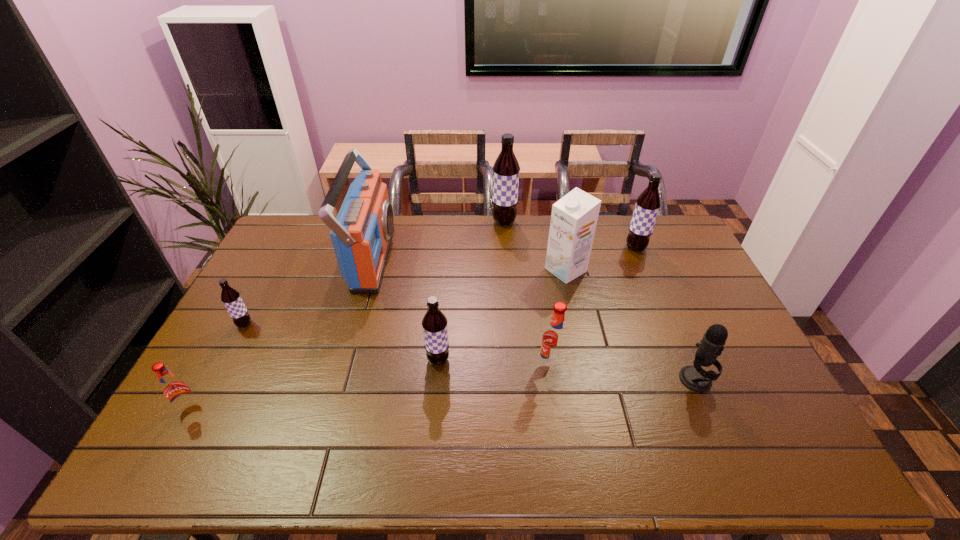
Find the location of a particular element. object that is the seventh closest to the leftmost brown root beer is located at coordinates (695, 378).

In order to click on root beer that stands as the fourth closest to the carton in this screenshot , I will do 434,323.

Image resolution: width=960 pixels, height=540 pixels. Find the location of `the closest root beer relative to the bigger red root beer`. the closest root beer relative to the bigger red root beer is located at coordinates (434, 323).

Where is `the closest brown root beer to the tallest root beer`? the closest brown root beer to the tallest root beer is located at coordinates (648, 203).

Identify which brown root beer is located as the second nearest to the black microphone. Please provide its 2D coordinates. Your answer should be formatted as a tuple, i.e. [(x, y)], where the tuple contains the x and y coordinates of a point satisfying the conditions above.

[(434, 323)]

Where is `vacant space that satisfies the following two spatial constraints: 1. on the front side of the farthest root beer; 2. on the left side of the second biggest brown root beer`? The image size is (960, 540). vacant space that satisfies the following two spatial constraints: 1. on the front side of the farthest root beer; 2. on the left side of the second biggest brown root beer is located at coordinates (506, 248).

The height and width of the screenshot is (540, 960). I want to click on free space that satisfies the following two spatial constraints: 1. on the front-facing side of the right red root beer; 2. on the right side of the third object from left to right, so click(x=342, y=366).

Image resolution: width=960 pixels, height=540 pixels. Identify the location of free space that satisfies the following two spatial constraints: 1. on the front side of the rightmost brown root beer; 2. on the right side of the farthest brown root beer. (506, 248).

Image resolution: width=960 pixels, height=540 pixels. I want to click on vacant region that satisfies the following two spatial constraints: 1. on the front-facing side of the third object from left to right; 2. on the back side of the third root beer from left to right, so click(343, 360).

At what (x,y) coordinates should I click in order to perform the action: click on vacant space that satisfies the following two spatial constraints: 1. on the back side of the farthest brown root beer; 2. on the left side of the nearest brown root beer. Please return your answer as a coordinate pair (x, y). The height and width of the screenshot is (540, 960). Looking at the image, I should click on (450, 222).